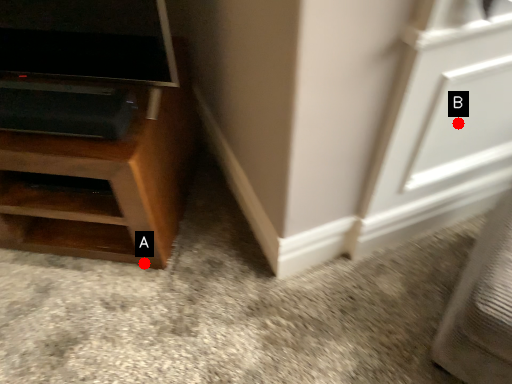
Question: Two points are circled on the image, labeled by A and B beside each circle. Among these points, which one is farthest from the camera?

Choices:
 (A) A is further
 (B) B is further

Answer: (A)